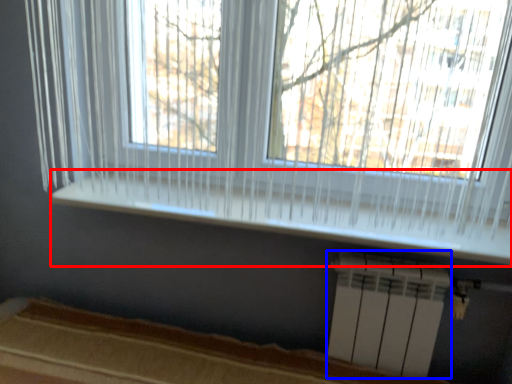
Question: Which object appears farthest to the camera in this image, window sill (highlighted by a red box) or air conditioning (highlighted by a blue box)?

Choices:
 (A) window sill
 (B) air conditioning

Answer: (B)